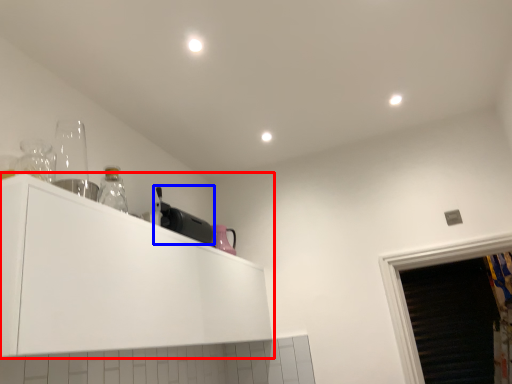
Question: Which point is closer to the camera, cabinetry (highlighted by a red box) or appliance (highlighted by a blue box)?

Choices:
 (A) cabinetry
 (B) appliance

Answer: (A)